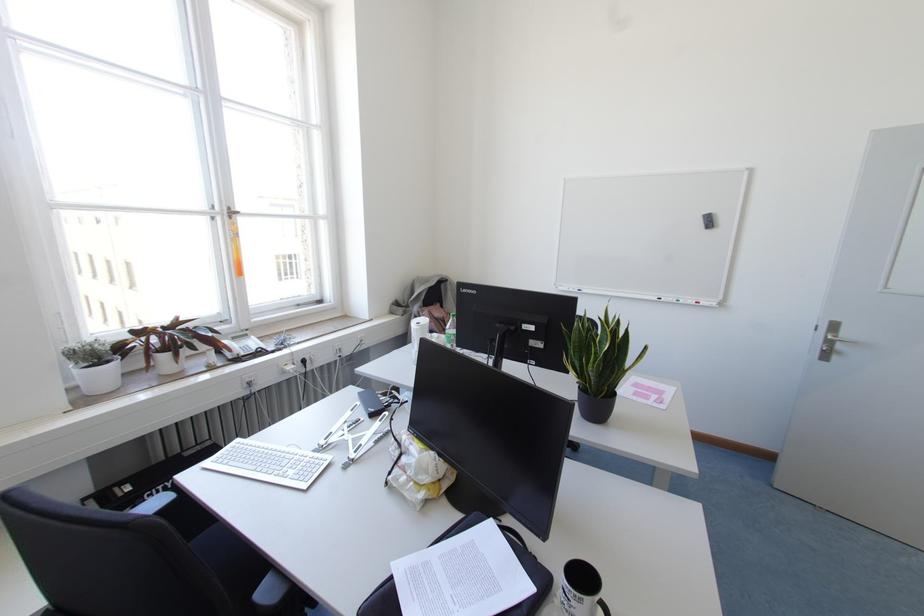
At what (x,y) coordinates should I click in order to perform the action: click on grey whiteboard eraser. Please return your answer as a coordinate pair (x, y). The height and width of the screenshot is (616, 924). Looking at the image, I should click on (657, 298).